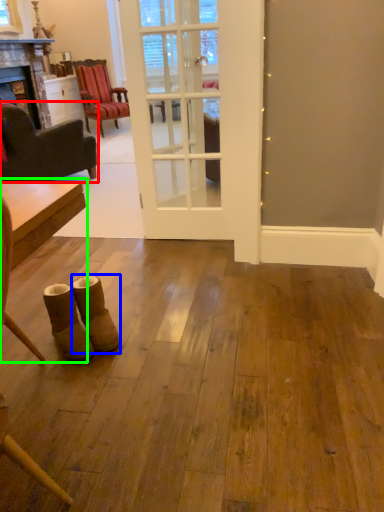
Question: Based on their relative distances, which object is farther from chair (highlighted by a red box)? Choose from footwear (highlighted by a blue box) and table (highlighted by a green box).

Choices:
 (A) footwear
 (B) table

Answer: (B)